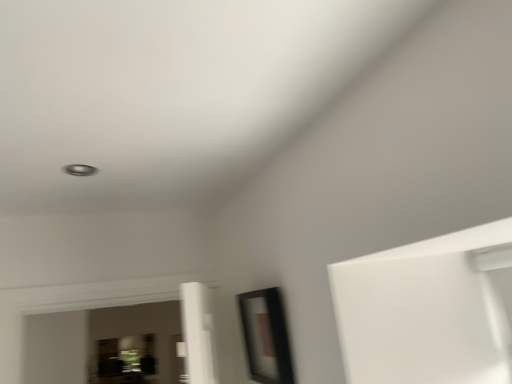
The width and height of the screenshot is (512, 384). What do you see at coordinates (266, 336) in the screenshot? I see `black matte picture frame at lower right` at bounding box center [266, 336].

Locate an element on the screen. black matte picture frame at lower right is located at coordinates (266, 336).

Locate an element on the screen. black matte picture frame at lower right is located at coordinates (266, 336).